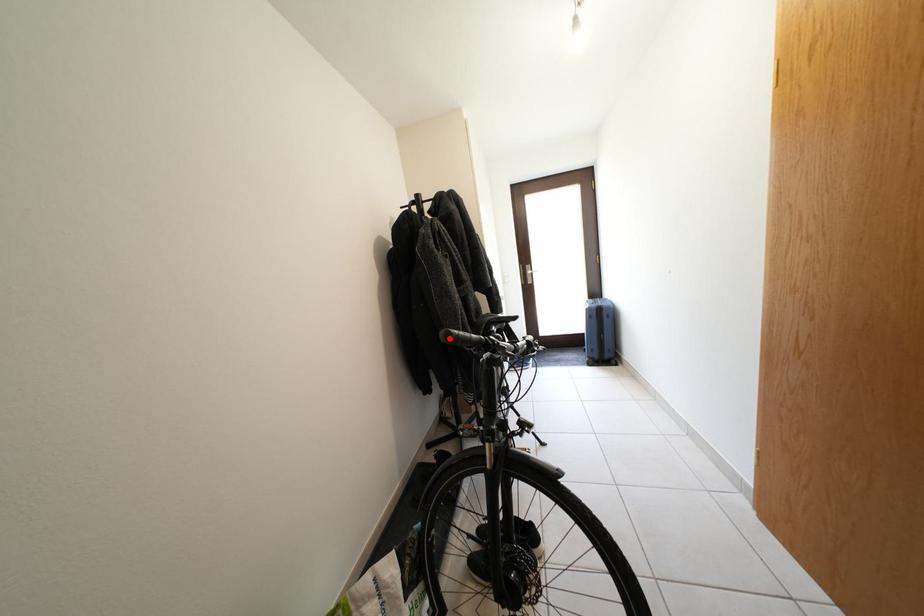
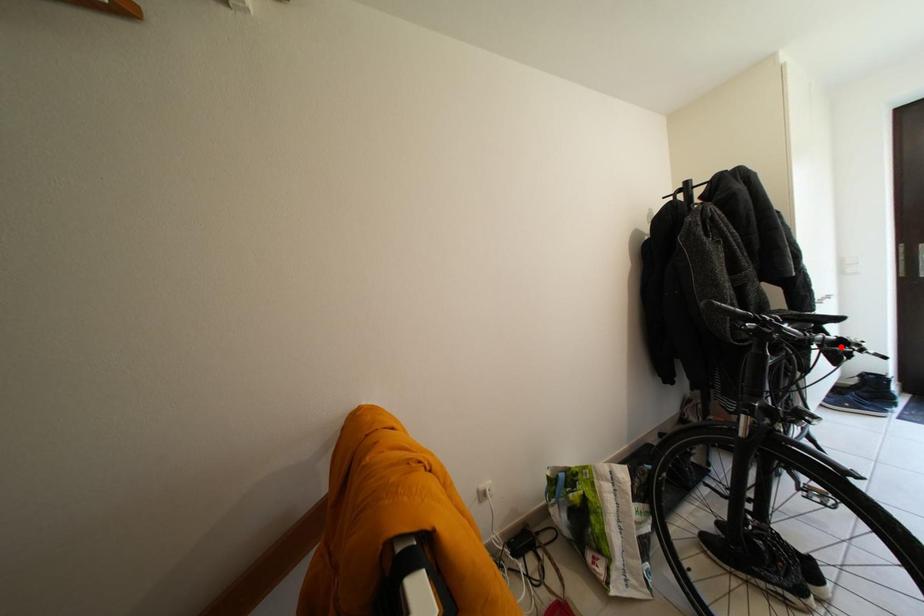
I am providing you with two images of the same scene from different viewpoints. A red point is marked on the first image and another point is marked on the second image. Are the points marked in image1 and image2 representing the same 3D position?

No